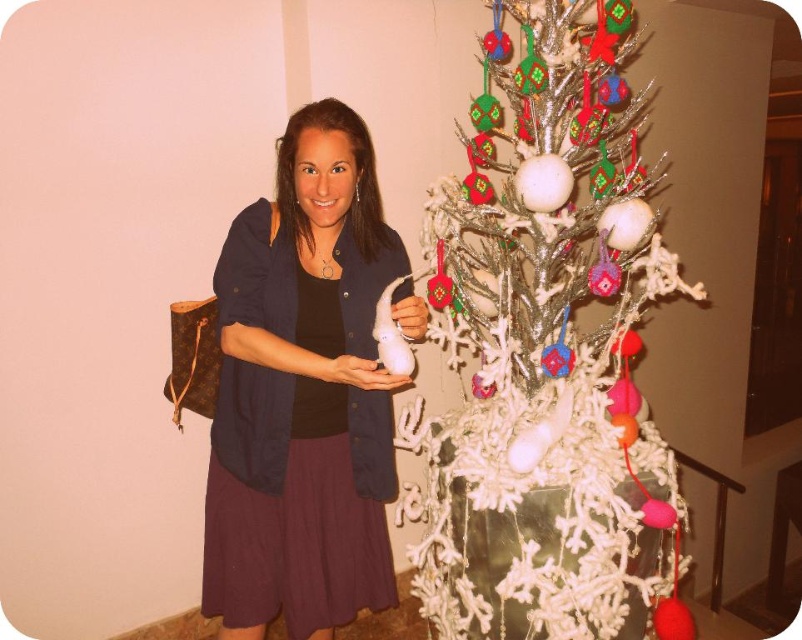
Question: Which point is closer to the camera?

Choices:
 (A) (545, 317)
 (B) (219, 442)

Answer: (B)

Question: Which of the following is the closest to the observer?

Choices:
 (A) (610, 600)
 (B) (254, 284)

Answer: (B)

Question: Can you confirm if white textured christmas tree at center is positioned below matte black sweater at center?

Choices:
 (A) yes
 (B) no

Answer: (B)

Question: Is white textured christmas tree at center wider than matte black sweater at center?

Choices:
 (A) no
 (B) yes

Answer: (B)

Question: Is white textured christmas tree at center above matte black sweater at center?

Choices:
 (A) yes
 (B) no

Answer: (A)

Question: Which object appears closest to the camera in this image?

Choices:
 (A) matte black sweater at center
 (B) white textured christmas tree at center

Answer: (A)